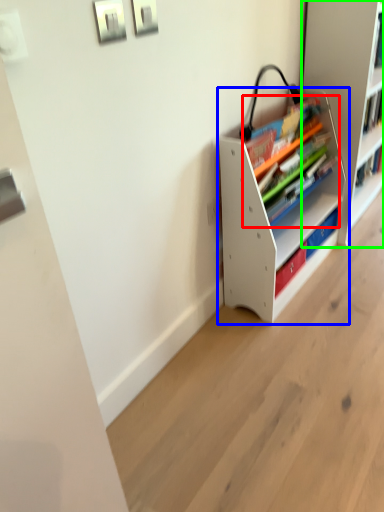
Question: Which is farther away from book (highlighted by a red box)? shelf (highlighted by a blue box) or shelf (highlighted by a green box)?

Choices:
 (A) shelf
 (B) shelf

Answer: (B)